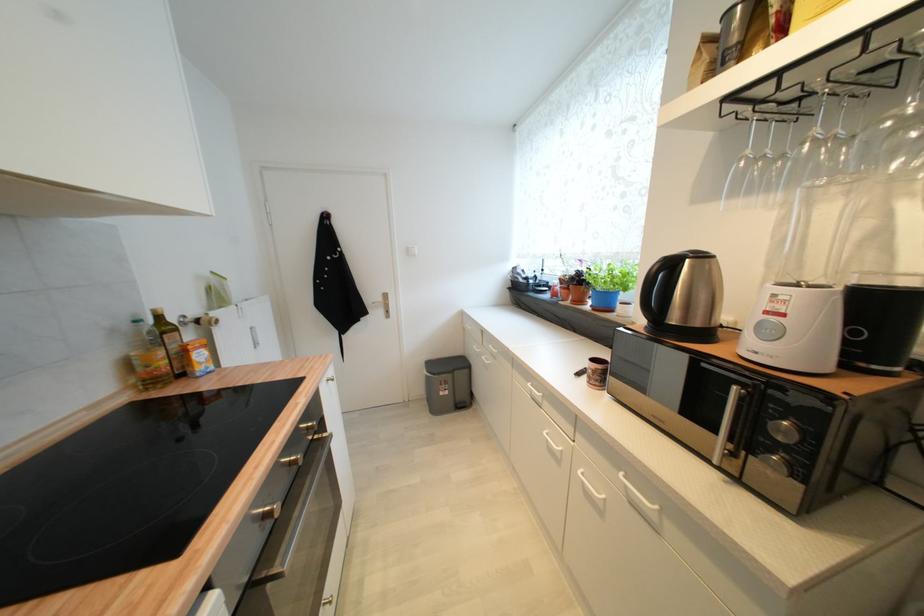
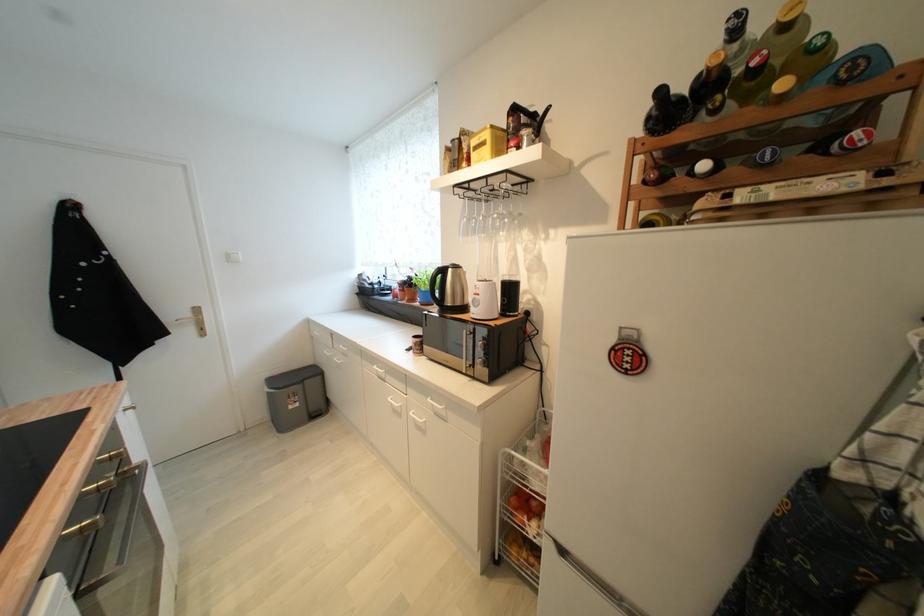
The point at (446, 395) is marked in the first image. Where is the corresponding point in the second image?

(296, 408)